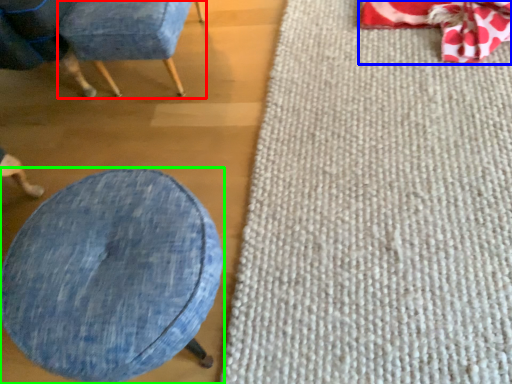
Question: Which is farther away from chair (highlighted by a red box)? bean bag chair (highlighted by a blue box) or furniture (highlighted by a green box)?

Choices:
 (A) bean bag chair
 (B) furniture

Answer: (A)